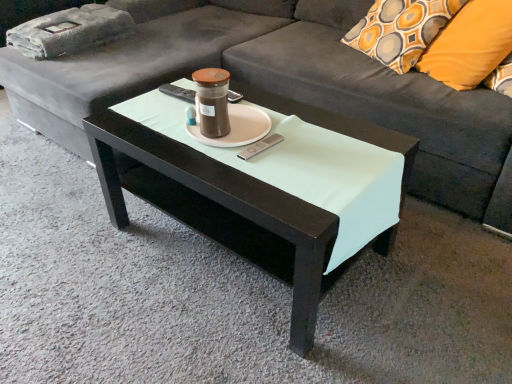
Question: Does point (497, 59) appear closer or farther from the camera than point (76, 129)?

Choices:
 (A) farther
 (B) closer

Answer: (B)

Question: Looking at their shapes, would you say orange fabric pillow at upper right is wider or thinner than dark gray fabric couch at center?

Choices:
 (A) thin
 (B) wide

Answer: (A)

Question: Which object is positioned farthest from the orange fabric pillow at upper right?

Choices:
 (A) matte black coffee table at center
 (B) dark gray fabric couch at center
 (C) matte brown glass candle holder at center

Answer: (C)

Question: Estimate the real-world distances between objects in this image. Which object is closer to the matte black coffee table at center?

Choices:
 (A) matte brown glass candle holder at center
 (B) orange fabric pillow at upper right
 (C) dark gray fabric couch at center

Answer: (A)